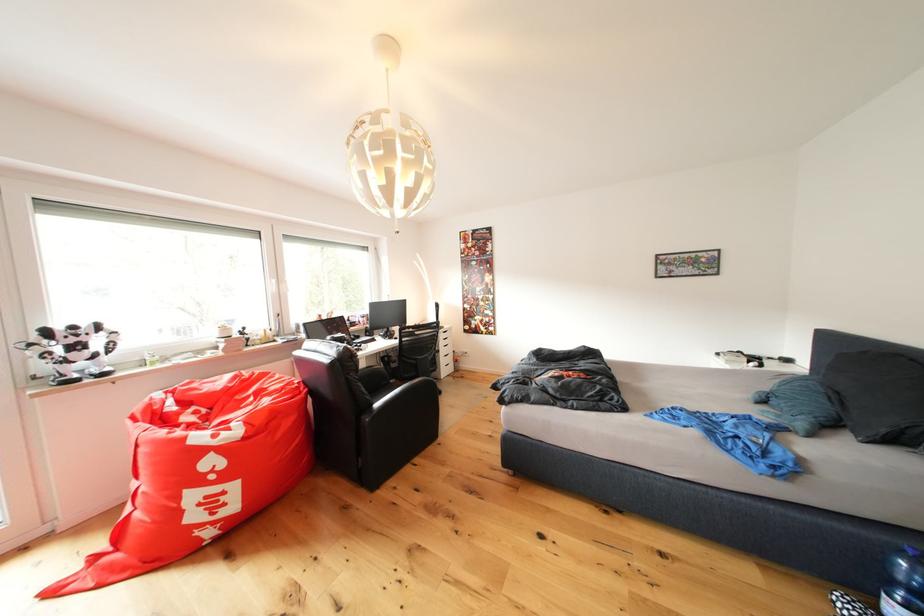
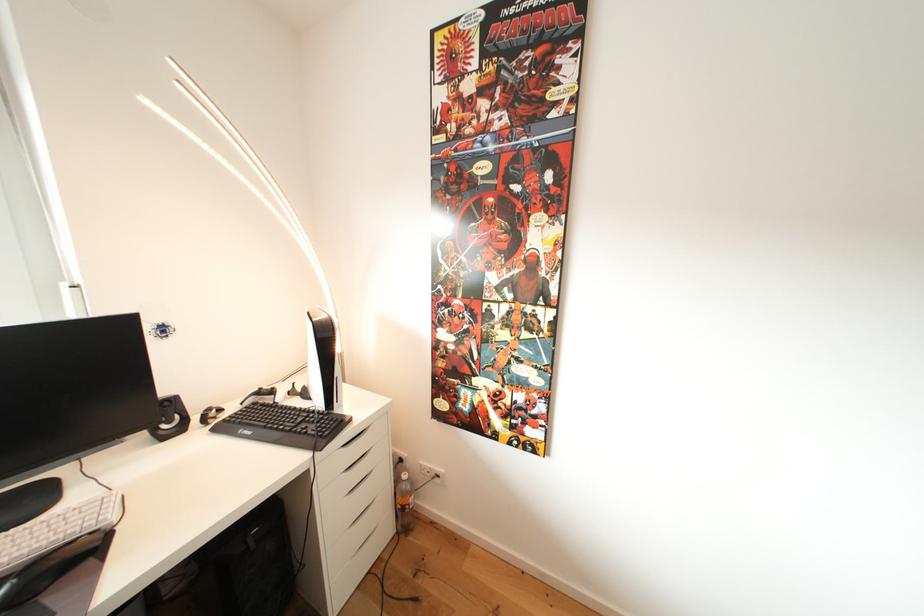
Question: The images are taken continuously from a first-person perspective. In which direction are you moving?

Choices:
 (A) Left
 (B) Right
 (C) Forward
 (D) Backward

Answer: (C)